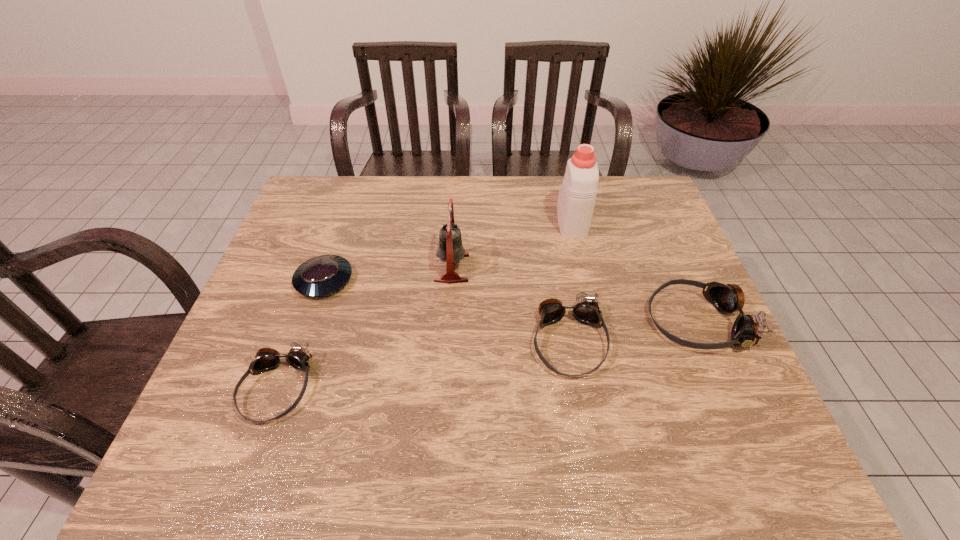
Locate an element on the screen. blank region between the second shortest goggles and the detergent is located at coordinates (570, 282).

Identify the location of empty space that is in between the rightmost object and the second goggles from right to left. (633, 332).

You are a GUI agent. You are given a task and a screenshot of the screen. Output one action in this format:
    pyautogui.click(x=<x>, y=<y>)
    Task: Click on the vacant area between the rightmost object and the shortest object
    
    Given the screenshot: What is the action you would take?
    pyautogui.click(x=511, y=301)

This screenshot has width=960, height=540. I want to click on vacant space in between the leftmost goggles and the second tallest object, so pos(365,328).

The image size is (960, 540). Identify the location of blank region between the bell and the second tallest goggles. (511, 305).

Identify the location of free space between the third shortest object and the detergent. The height and width of the screenshot is (540, 960). (570, 282).

Find the location of a particular element. This screenshot has height=540, width=960. vacant space that's between the fourth object from right to left and the farthest object is located at coordinates point(512,245).

Where is `vacant space that is in between the fifth shortest object and the leftmost goggles`? Image resolution: width=960 pixels, height=540 pixels. vacant space that is in between the fifth shortest object and the leftmost goggles is located at coordinates (365, 328).

Image resolution: width=960 pixels, height=540 pixels. In order to click on empty space that is in between the detergent and the second shortest object in this screenshot , I will do `click(424, 305)`.

You are a GUI agent. You are given a task and a screenshot of the screen. Output one action in this format:
    pyautogui.click(x=<x>, y=<y>)
    Task: Click on the free space between the tallest object and the rightmost object
    The image size is (960, 540).
    Given the screenshot: What is the action you would take?
    pyautogui.click(x=635, y=272)